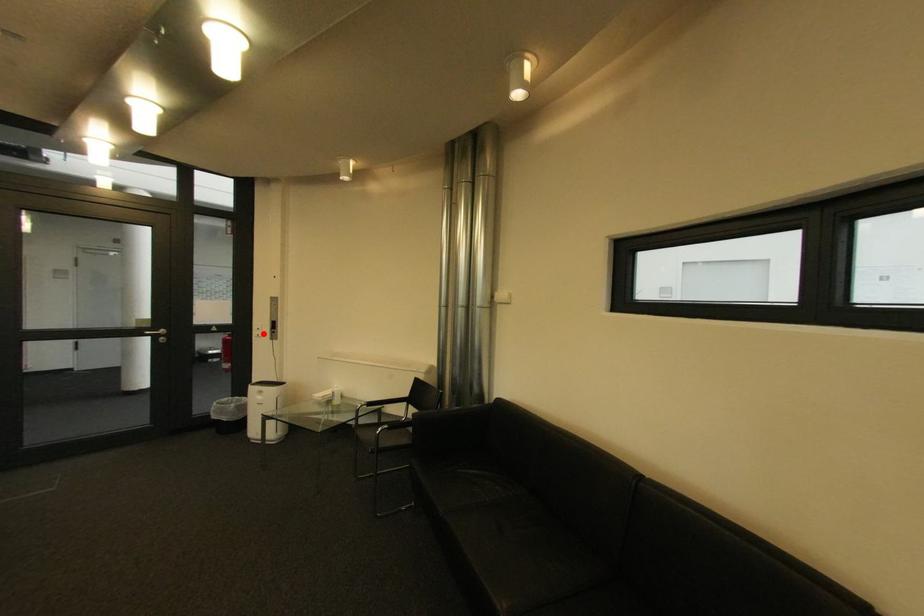
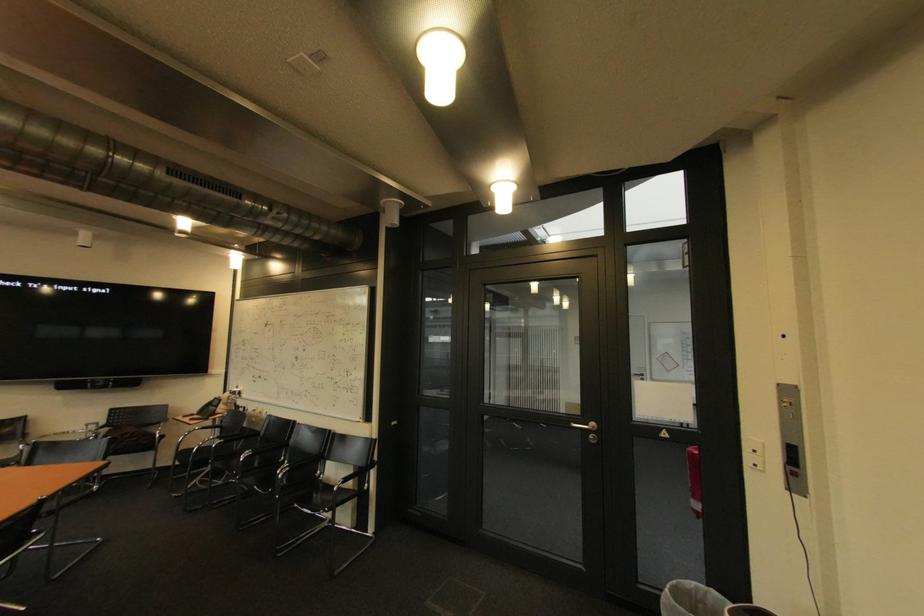
Where in the second image is the point corresponding to the highlighted location from the first image?

(757, 459)